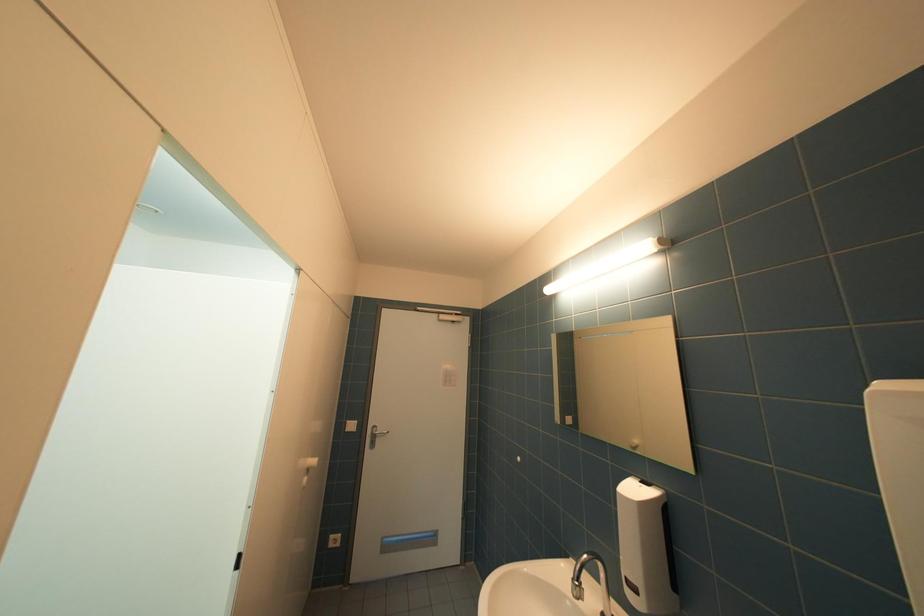
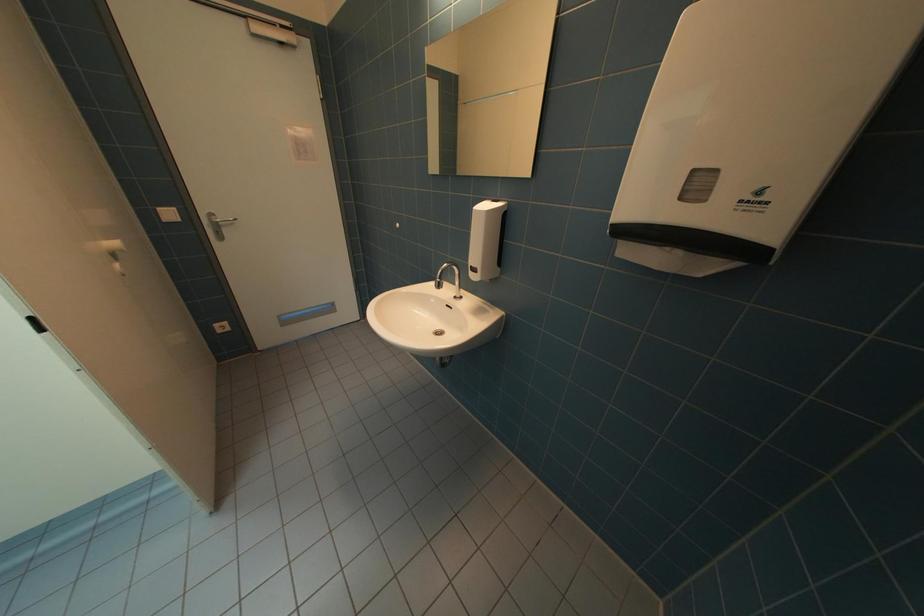
Based on the continuous images, in which direction is the camera rotating?

The rotation direction of the camera is right-down.